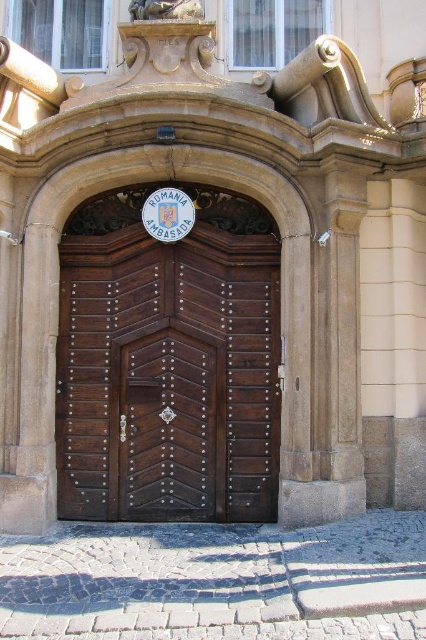
Can you confirm if polished wood door at center is smaller than dark wood door at center?

No.

Is polished wood door at center bigger than dark wood door at center?

Yes.

Which is behind, point (65, 420) or point (193, 360)?

Point (193, 360)

You are a GUI agent. You are given a task and a screenshot of the screen. Output one action in this format:
    pyautogui.click(x=<x>, y=<y>)
    Task: Click on the polished wood door at center
    
    Given the screenshot: What is the action you would take?
    pyautogui.click(x=169, y=362)